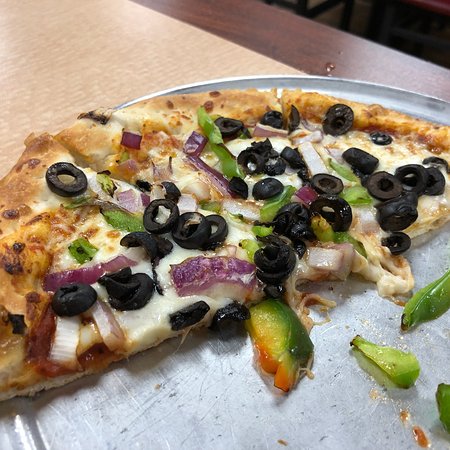
At what (x,y) coordinates should I click in order to perform the action: click on chair leg. Please return your answer as a coordinate pair (x, y). Looking at the image, I should click on (306, 7).